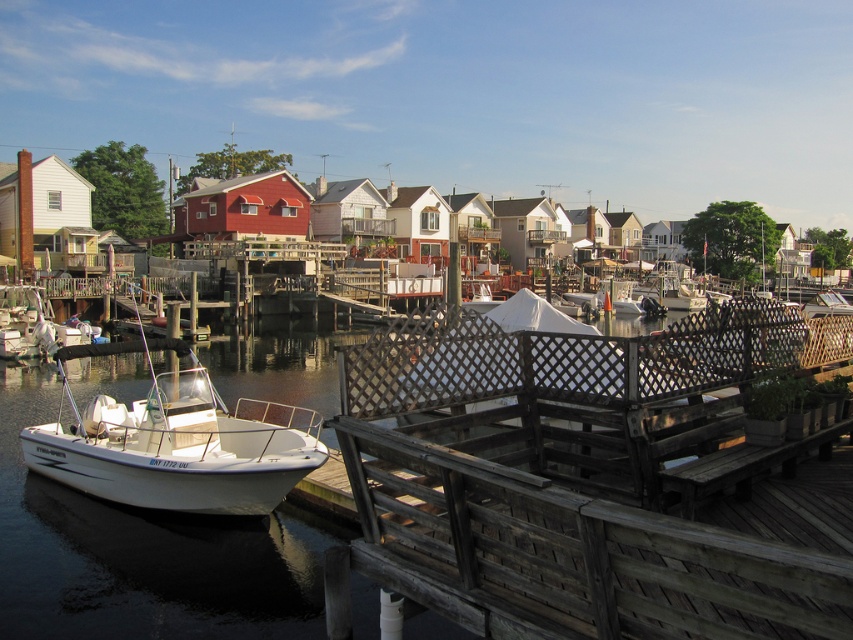
Question: Can you confirm if wooden dock at center is positioned to the left of white matte boat at lower left?

Choices:
 (A) no
 (B) yes

Answer: (A)

Question: Which object is closer to the camera taking this photo?

Choices:
 (A) white matte boat at lower left
 (B) wooden dock at center

Answer: (B)

Question: Does wooden dock at center appear on the right side of white matte boat at lower left?

Choices:
 (A) no
 (B) yes

Answer: (B)

Question: Is wooden dock at center wider than white matte boat at lower left?

Choices:
 (A) yes
 (B) no

Answer: (B)

Question: Among these objects, which one is farthest from the camera?

Choices:
 (A) white matte boat at lower left
 (B) wooden dock at center

Answer: (A)